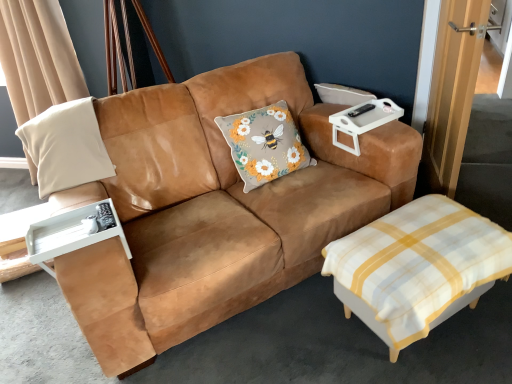
Question: Is white checkered ottoman at lower right positioned in front of white plastic tray at upper right?

Choices:
 (A) yes
 (B) no

Answer: (A)

Question: Is white plastic tray at upper right at the back of white checkered ottoman at lower right?

Choices:
 (A) yes
 (B) no

Answer: (B)

Question: From the image's perspective, would you say white checkered ottoman at lower right is shown under white plastic tray at upper right?

Choices:
 (A) no
 (B) yes

Answer: (B)

Question: From a real-world perspective, does white checkered ottoman at lower right sit lower than white plastic tray at upper right?

Choices:
 (A) yes
 (B) no

Answer: (A)

Question: Would you say white checkered ottoman at lower right is a long distance from white plastic tray at upper right?

Choices:
 (A) yes
 (B) no

Answer: (B)

Question: Considering their positions, is white plastic tray at left located in front of or behind white checkered ottoman at lower right?

Choices:
 (A) front
 (B) behind

Answer: (B)

Question: In terms of width, does white plastic tray at left look wider or thinner when compared to white checkered ottoman at lower right?

Choices:
 (A) thin
 (B) wide

Answer: (A)

Question: From a real-world perspective, relative to white checkered ottoman at lower right, is white plastic tray at left vertically above or below?

Choices:
 (A) below
 (B) above

Answer: (B)

Question: From the image's perspective, is white plastic tray at left positioned above or below white checkered ottoman at lower right?

Choices:
 (A) below
 (B) above

Answer: (B)

Question: Considering the positions of point (187, 218) and point (73, 225), is point (187, 218) closer or farther from the camera than point (73, 225)?

Choices:
 (A) farther
 (B) closer

Answer: (A)

Question: From the image's perspective, is suede tan couch at center positioned above or below white plastic tray at left?

Choices:
 (A) above
 (B) below

Answer: (A)

Question: Considering their positions, is suede tan couch at center located in front of or behind white plastic tray at left?

Choices:
 (A) behind
 (B) front

Answer: (B)

Question: Would you say suede tan couch at center is inside or outside white plastic tray at left?

Choices:
 (A) inside
 (B) outside

Answer: (B)

Question: Considering the positions of white checkered ottoman at lower right and suede tan couch at center in the image, is white checkered ottoman at lower right taller or shorter than suede tan couch at center?

Choices:
 (A) tall
 (B) short

Answer: (B)

Question: Based on their positions, is white checkered ottoman at lower right located to the left or right of suede tan couch at center?

Choices:
 (A) left
 (B) right

Answer: (B)